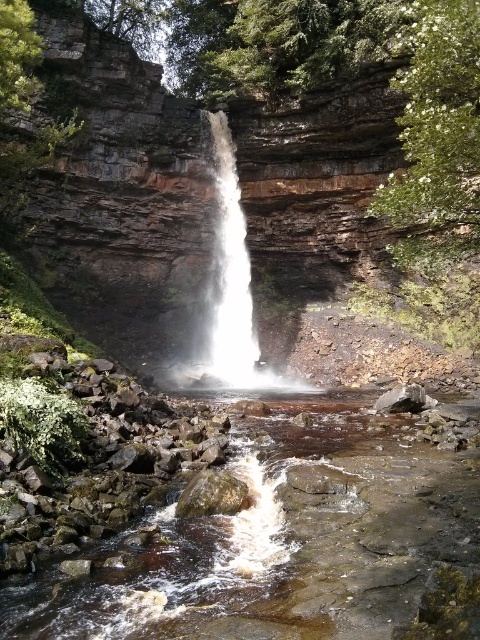
You are standing at the edge of the brown rocky stream at center. Based on the coordinates given, in which direction should you move to reach the waterfall?

The brown rocky stream at center is located at coordinates (280,545). Since the waterfall is centrally positioned in the scene, you should move towards the center to reach it.